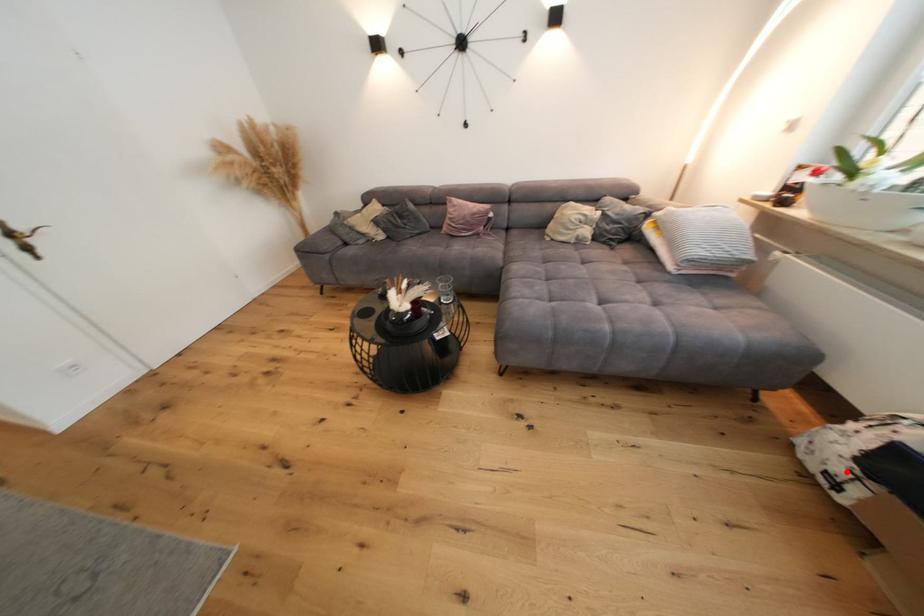
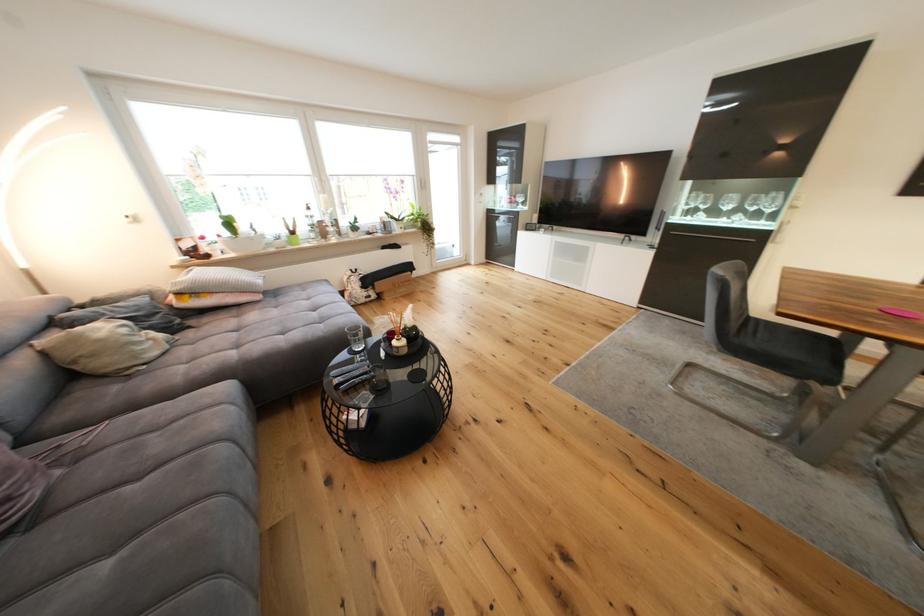
Question: I am providing you with two images of the same scene from different viewpoints. A red point is shown in image1. For the corresponding object point in image2, is it positioned nearer or farther from the camera?

Choices:
 (A) Nearer
 (B) Farther

Answer: (A)